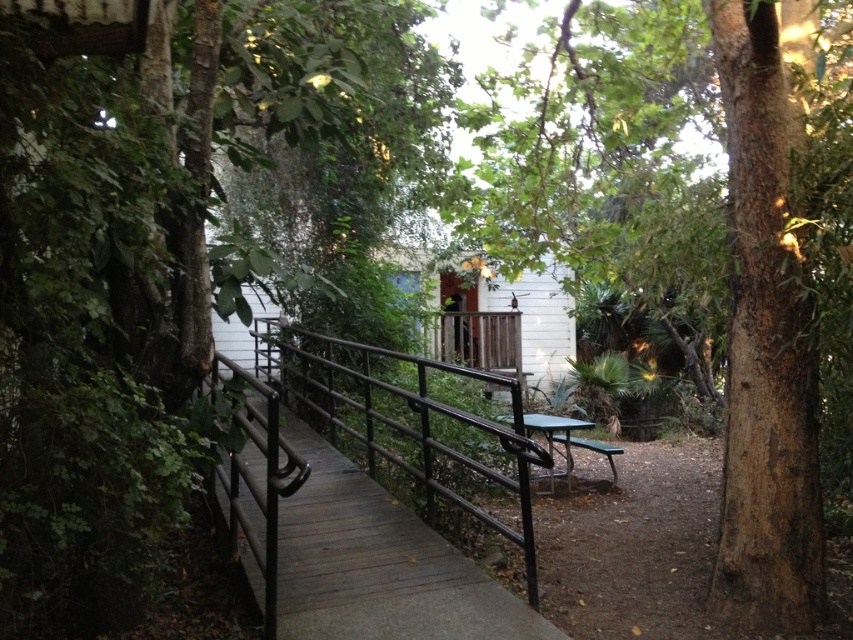
You are planning to set up a picnic and need to place a blanket between the green leafy tree at center and the green plastic picnic table at center. Based on their positions, which side of the picnic table should you place the blanket?

The green leafy tree at center is to the left of the green plastic picnic table at center, so you should place the blanket to the left side of the picnic table.

You are standing on the wooden walkway and notice two trees at the center of the image. Which tree, the green leafy tree at center or the brown rough tree at center, is taller?

The green leafy tree at center is taller than the brown rough tree at center.